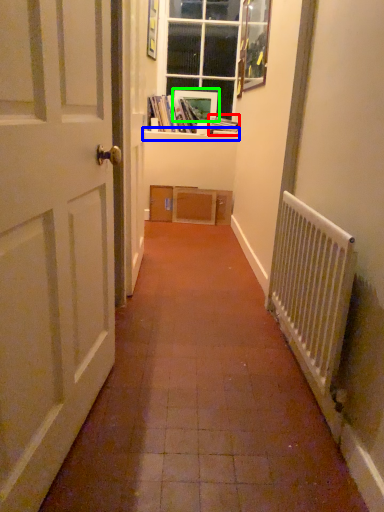
Question: Which object is the farthest from book (highlighted by a red box)? Choose among these: window sill (highlighted by a blue box) or picture frame (highlighted by a green box).

Choices:
 (A) window sill
 (B) picture frame

Answer: (B)